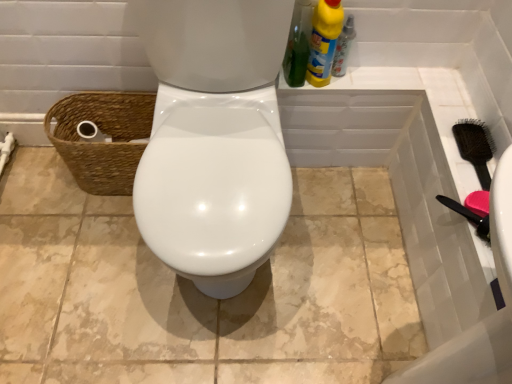
Locate an element on the screen. The image size is (512, 384). vacant area that is situated to the right of yellow plastic bottle at upper right is located at coordinates (380, 70).